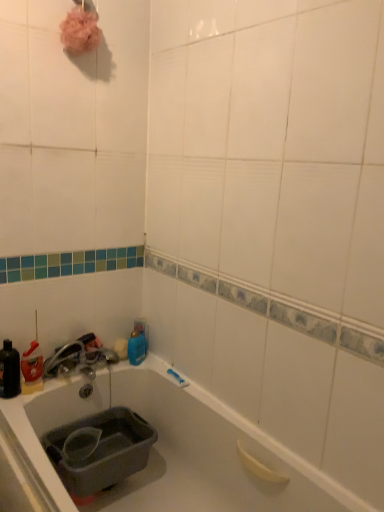
This screenshot has height=512, width=384. Describe the element at coordinates (78, 357) in the screenshot. I see `satin nickel faucet at lower left` at that location.

This screenshot has height=512, width=384. Find the location of `matte black bottle at left, which ranks as the second bottle in back-to-front order`. matte black bottle at left, which ranks as the second bottle in back-to-front order is located at coordinates (9, 371).

The width and height of the screenshot is (384, 512). What do you see at coordinates (9, 371) in the screenshot?
I see `matte black bottle at left, which ranks as the second bottle in back-to-front order` at bounding box center [9, 371].

The height and width of the screenshot is (512, 384). Identify the location of satin nickel faucet at lower left. (78, 357).

From the picture: Can you tell me how much gray plastic sink at lower left and matte black bottle at left, the first bottle from the left, differ in facing direction?

0.647 degrees separate the facing orientations of gray plastic sink at lower left and matte black bottle at left, the first bottle from the left.

Considering the positions of point (107, 430) and point (14, 361), is point (107, 430) closer or farther from the camera than point (14, 361)?

Point (107, 430) is positioned farther from the camera compared to point (14, 361).

Considering the sizes of objects gray plastic sink at lower left and matte black bottle at left, which appears as the second bottle when viewed from the right, in the image provided, who is thinner, gray plastic sink at lower left or matte black bottle at left, which appears as the second bottle when viewed from the right,?

Thinner between the two is matte black bottle at left, which appears as the second bottle when viewed from the right.

Based on the photo, can you confirm if gray plastic sink at lower left is taller than matte black bottle at left, which ranks as the second bottle in back-to-front order?

No, gray plastic sink at lower left is not taller than matte black bottle at left, which ranks as the second bottle in back-to-front order.

Can you tell me how much matte black bottle at left, which appears as the second bottle when viewed from the right, and gray plastic sink at lower left differ in facing direction?

The facing directions of matte black bottle at left, which appears as the second bottle when viewed from the right, and gray plastic sink at lower left are 0.647 degrees apart.

Looking at this image, is matte black bottle at left, which appears as the second bottle when viewed from the right, in front of or behind gray plastic sink at lower left in the image?

matte black bottle at left, which appears as the second bottle when viewed from the right, is positioned farther from the viewer than gray plastic sink at lower left.

From the image's perspective, between matte black bottle at left, arranged as the 1th bottle when viewed from the front, and gray plastic sink at lower left, which one is located above?

matte black bottle at left, arranged as the 1th bottle when viewed from the front.

Does point (1, 364) come behind point (121, 450)?

Yes, it is.

I want to click on bottle in front of the satin nickel faucet at lower left, so click(x=9, y=371).

From their relative heights in the image, would you say satin nickel faucet at lower left is taller or shorter than matte black bottle at left, the first bottle from the left?

In the image, satin nickel faucet at lower left appears to be shorter than matte black bottle at left, the first bottle from the left.

Is satin nickel faucet at lower left turned away from matte black bottle at left, arranged as the 1th bottle when viewed from the front?

satin nickel faucet at lower left is not turned away from matte black bottle at left, arranged as the 1th bottle when viewed from the front.

Could you measure the distance between satin nickel faucet at lower left and matte black bottle at left, arranged as the 1th bottle when viewed from the front?

satin nickel faucet at lower left and matte black bottle at left, arranged as the 1th bottle when viewed from the front, are 8.99 inches apart.

Considering the sizes of objects satin nickel faucet at lower left and gray plastic sink at lower left in the image provided, who is taller, satin nickel faucet at lower left or gray plastic sink at lower left?

gray plastic sink at lower left is taller.

Does satin nickel faucet at lower left lie in front of gray plastic sink at lower left?

No, it is behind gray plastic sink at lower left.

From the image's perspective, is satin nickel faucet at lower left over gray plastic sink at lower left?

Yes, from the image's perspective, satin nickel faucet at lower left is over gray plastic sink at lower left.

Does satin nickel faucet at lower left touch gray plastic sink at lower left?

satin nickel faucet at lower left and gray plastic sink at lower left are not in contact.

Considering the positions of objects blue glossy bottle at upper center, which appears as the first bottle when viewed from the right, and gray plastic sink at lower left in the image provided, who is more to the left, blue glossy bottle at upper center, which appears as the first bottle when viewed from the right, or gray plastic sink at lower left?

From the viewer's perspective, gray plastic sink at lower left appears more on the left side.

From a real-world perspective, is blue glossy bottle at upper center, the second bottle from the left, beneath gray plastic sink at lower left?

No, from a real-world perspective, blue glossy bottle at upper center, the second bottle from the left, is not below gray plastic sink at lower left.

Who is bigger, blue glossy bottle at upper center, which appears as the first bottle when viewed from the right, or gray plastic sink at lower left?

Bigger between the two is gray plastic sink at lower left.

From the image's perspective, is satin nickel faucet at lower left under blue glossy bottle at upper center, which appears as the first bottle when viewed from the right?

Correct, satin nickel faucet at lower left appears lower than blue glossy bottle at upper center, which appears as the first bottle when viewed from the right, in the image.

Find the location of a particular element. bottle that is the 2nd one when counting upward from the satin nickel faucet at lower left (from the image's perspective) is located at coordinates (137, 344).

From a real-world perspective, who is located higher, satin nickel faucet at lower left or blue glossy bottle at upper center, which is counted as the 1th bottle, starting from the back?

satin nickel faucet at lower left is physically above.

Is satin nickel faucet at lower left beside blue glossy bottle at upper center, which is counted as the 1th bottle, starting from the back?

No, satin nickel faucet at lower left is not next to blue glossy bottle at upper center, which is counted as the 1th bottle, starting from the back.

Can you confirm if matte black bottle at left, which appears as the second bottle when viewed from the right, is wider than blue glossy bottle at upper center, which appears as the first bottle when viewed from the right?

Yes, matte black bottle at left, which appears as the second bottle when viewed from the right, is wider than blue glossy bottle at upper center, which appears as the first bottle when viewed from the right.

Is matte black bottle at left, the first bottle from the left, positioned with its back to blue glossy bottle at upper center, which appears as the first bottle when viewed from the right?

No, matte black bottle at left, the first bottle from the left, is not facing away from blue glossy bottle at upper center, which appears as the first bottle when viewed from the right.

Is matte black bottle at left, which ranks as the second bottle in back-to-front order, in contact with blue glossy bottle at upper center, placed as the 2th bottle when sorted from front to back?

They are not placed beside each other.

From a real-world perspective, count 2nd bottles upward from the gray plastic sink at lower left and point to it. Please provide its 2D coordinates.

[(9, 371)]

From the image's perspective, count 1st bottles upward from the gray plastic sink at lower left and point to it. Please provide its 2D coordinates.

[(9, 371)]

Estimate the real-world distances between objects in this image. Which object is closer to matte black bottle at left, arranged as the 1th bottle when viewed from the front, satin nickel faucet at lower left or gray plastic sink at lower left?

Based on the image, satin nickel faucet at lower left appears to be nearer to matte black bottle at left, arranged as the 1th bottle when viewed from the front.

Looking at the image, which one is located further to blue glossy bottle at upper center, placed as the 2th bottle when sorted from front to back, gray plastic sink at lower left or matte black bottle at left, arranged as the 1th bottle when viewed from the front?

Based on the image, matte black bottle at left, arranged as the 1th bottle when viewed from the front, appears to be further to blue glossy bottle at upper center, placed as the 2th bottle when sorted from front to back.

Considering their positions, is matte black bottle at left, which ranks as the second bottle in back-to-front order, positioned further to gray plastic sink at lower left than satin nickel faucet at lower left?

matte black bottle at left, which ranks as the second bottle in back-to-front order.

When comparing their distances from satin nickel faucet at lower left, does matte black bottle at left, which ranks as the second bottle in back-to-front order, or blue glossy bottle at upper center, the second bottle from the left, seem closer?

blue glossy bottle at upper center, the second bottle from the left.

From the image, which object appears to be nearer to satin nickel faucet at lower left, blue glossy bottle at upper center, the second bottle from the left, or matte black bottle at left, the first bottle from the left?

Among the two, blue glossy bottle at upper center, the second bottle from the left, is located nearer to satin nickel faucet at lower left.

Looking at the image, which one is located further to satin nickel faucet at lower left, gray plastic sink at lower left or blue glossy bottle at upper center, placed as the 2th bottle when sorted from front to back?

Based on the image, gray plastic sink at lower left appears to be further to satin nickel faucet at lower left.

Based on their spatial positions, is blue glossy bottle at upper center, the second bottle from the left, or gray plastic sink at lower left further from matte black bottle at left, which ranks as the second bottle in back-to-front order?

blue glossy bottle at upper center, the second bottle from the left, is further to matte black bottle at left, which ranks as the second bottle in back-to-front order.

Looking at the image, which one is located closer to satin nickel faucet at lower left, gray plastic sink at lower left or matte black bottle at left, which appears as the second bottle when viewed from the right?

The object closer to satin nickel faucet at lower left is matte black bottle at left, which appears as the second bottle when viewed from the right.

The width and height of the screenshot is (384, 512). I want to click on faucet between matte black bottle at left, which appears as the second bottle when viewed from the right, and gray plastic sink at lower left from top to bottom, so click(x=78, y=357).

Locate an element on the screen. faucet between matte black bottle at left, which appears as the second bottle when viewed from the right, and blue glossy bottle at upper center, which is counted as the 1th bottle, starting from the back, in the horizontal direction is located at coordinates (78, 357).

You are a GUI agent. You are given a task and a screenshot of the screen. Output one action in this format:
    pyautogui.click(x=<x>, y=<y>)
    Task: Click on the sink located between matte black bottle at left, which ranks as the second bottle in back-to-front order, and blue glossy bottle at upper center, which appears as the first bottle when viewed from the right, in the left-right direction
    The height and width of the screenshot is (512, 384).
    Given the screenshot: What is the action you would take?
    pyautogui.click(x=92, y=441)

Identify the location of faucet positioned between gray plastic sink at lower left and blue glossy bottle at upper center, placed as the 2th bottle when sorted from front to back, from near to far. (78, 357).